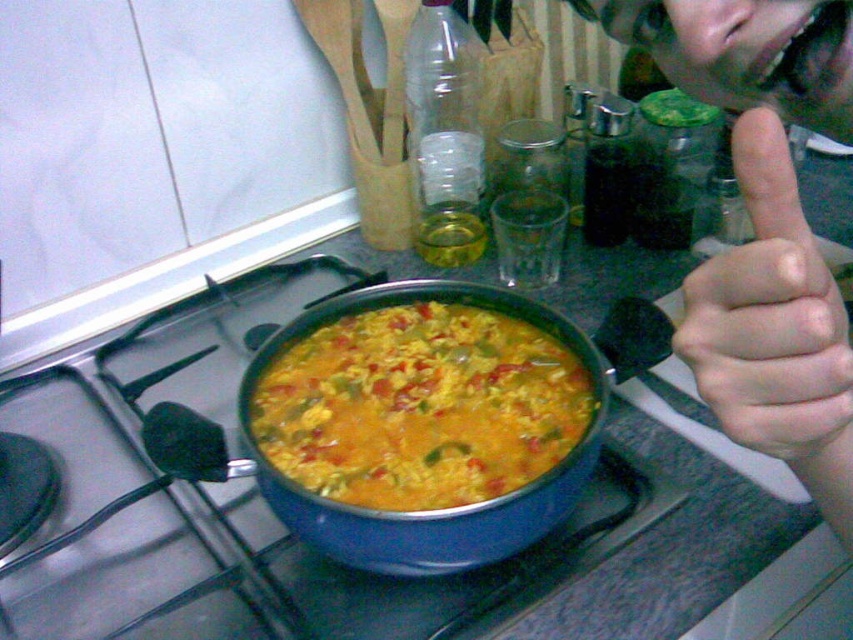
Question: Is yellow matte rice at center positioned in front of pale skin hand at upper right?

Choices:
 (A) yes
 (B) no

Answer: (B)

Question: Estimate the real-world distances between objects in this image. Which object is farther from the blue matte pan at center?

Choices:
 (A) yellow matte rice at center
 (B) pale skin hand at upper right

Answer: (B)

Question: Observing the image, what is the correct spatial positioning of blue matte pan at center in reference to pale skin hand at upper right?

Choices:
 (A) left
 (B) right

Answer: (A)

Question: Which point appears closest to the camera in this image?

Choices:
 (A) (47, 536)
 (B) (410, 385)

Answer: (B)

Question: Can you confirm if yellow matte rice at center is positioned above pale skin hand at upper right?

Choices:
 (A) no
 (B) yes

Answer: (A)

Question: Which object is the closest to the blue matte pan at center?

Choices:
 (A) pale skin hand at upper right
 (B) yellow matte rice at center

Answer: (B)